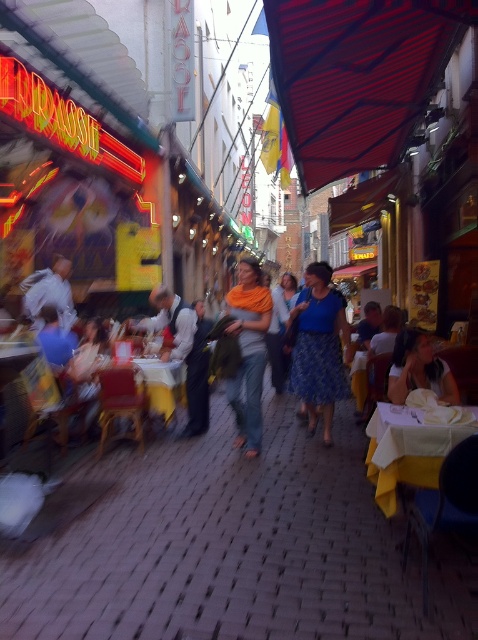
You are a street performer planning to set up a small stage between the red fabric canopy at upper center and the orange scarf at center. Given that your stage requires a minimum width of 2 meters, can you determine if the space between them is sufficient?

The red fabric canopy at upper center is wider than the orange scarf at center, but the exact distance between them isn not specified in the description. Therefore, it is uncertain whether the space between them meets the 2 meter requirement.

You are standing at the point closer to the camera in the image. Which point are you at, point (358,132) or point (250,428)?

You are at point (358,132) because it is further to the camera than point (250,428).